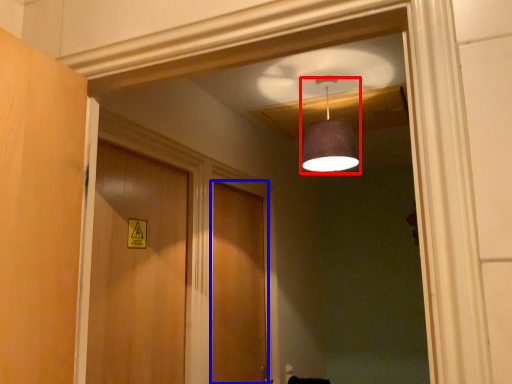
Question: Which object is further to the camera taking this photo, light fixture (highlighted by a red box) or door (highlighted by a blue box)?

Choices:
 (A) light fixture
 (B) door

Answer: (B)